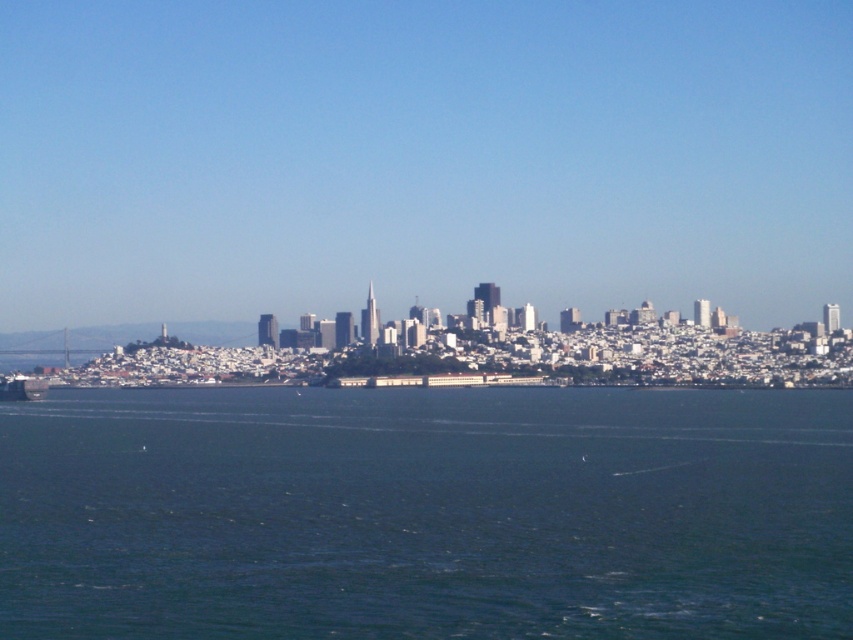
You are a photographer planning to capture the entire city skyline in one shot. You notice the blue liquid water at center and the metallic gray ship at lower left in your viewfinder. Considering their sizes in the frame, which object would require you to adjust your camera angle to include both in the composition?

The blue liquid water at center has a larger size compared to the metallic gray ship at lower left, so you would need to adjust your camera angle to ensure both the blue liquid water at center and the metallic gray ship at lower left fit into the frame.

You are a photographer standing on a hill near the left side of the image. You want to capture a photo that includes both the blue liquid water at center and the metallic gray ship at lower left. Which object should you adjust your camera angle to focus on first to ensure both are in the frame?

The blue liquid water at center is closer to the viewer than the metallic gray ship at lower left. To ensure both are in the frame, focus on the blue liquid water at center first, as it is nearer and adjusting the angle to include it will naturally bring the metallic gray ship at lower left into the background.

You are a photographer planning to capture the city skyline from the water. You have a drone that can fly up to 100 meters. Considering the blue liquid water at center and the metallic gray ship at lower left, which object would require the drone to ascend higher to fully capture its height in the photo?

The blue liquid water at center has a greater height compared to the metallic gray ship at lower left, so the drone would need to ascend higher to fully capture the height of the blue liquid water at center.